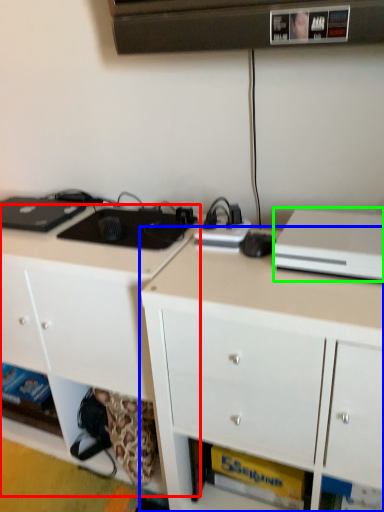
Question: Which object is the closest to the cabinetry (highlighted by a red box)? Choose among these: cabinetry (highlighted by a blue box) or desktop computer (highlighted by a green box).

Choices:
 (A) cabinetry
 (B) desktop computer

Answer: (A)